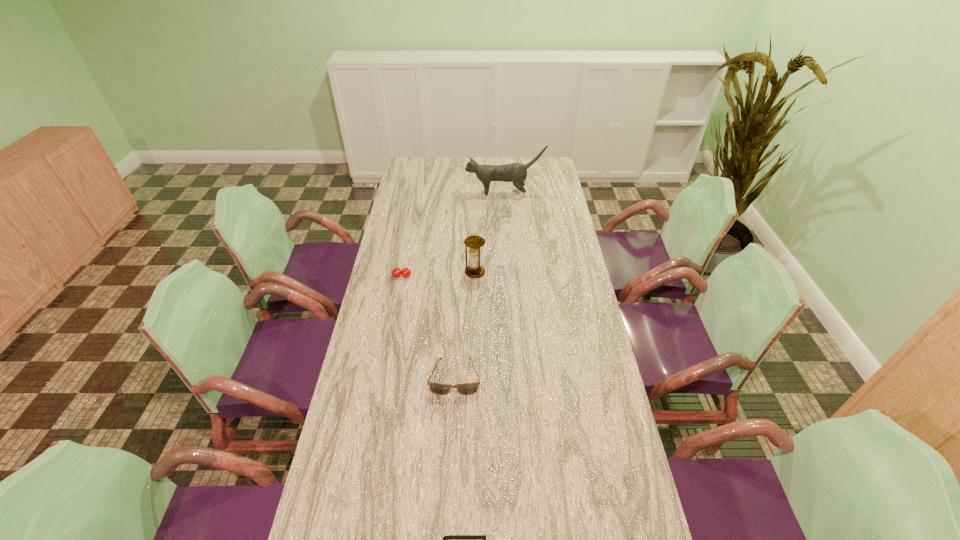
At what (x,y) coordinates should I click in order to perform the action: click on free spot between the taller sunglasses and the tallest object. Please return your answer as a coordinate pair (x, y). The image size is (960, 540). Looking at the image, I should click on (480, 286).

Identify the location of vacant area between the cat and the leftmost object. (453, 235).

The image size is (960, 540). What are the coordinates of `free space between the farthest object and the cherry` in the screenshot? It's located at (453, 235).

Locate an element on the screen. The image size is (960, 540). object that stands as the closest to the farthest object is located at coordinates (474, 270).

Identify which object is located as the fourth nearest to the nearer sunglasses. Please provide its 2D coordinates. Your answer should be formatted as a tuple, i.e. [(x, y)], where the tuple contains the x and y coordinates of a point satisfying the conditions above.

[(516, 173)]

I want to click on vacant area in the image that satisfies the following two spatial constraints: 1. at the face of the farthest object; 2. on the frames of the fourth tallest object, so click(517, 377).